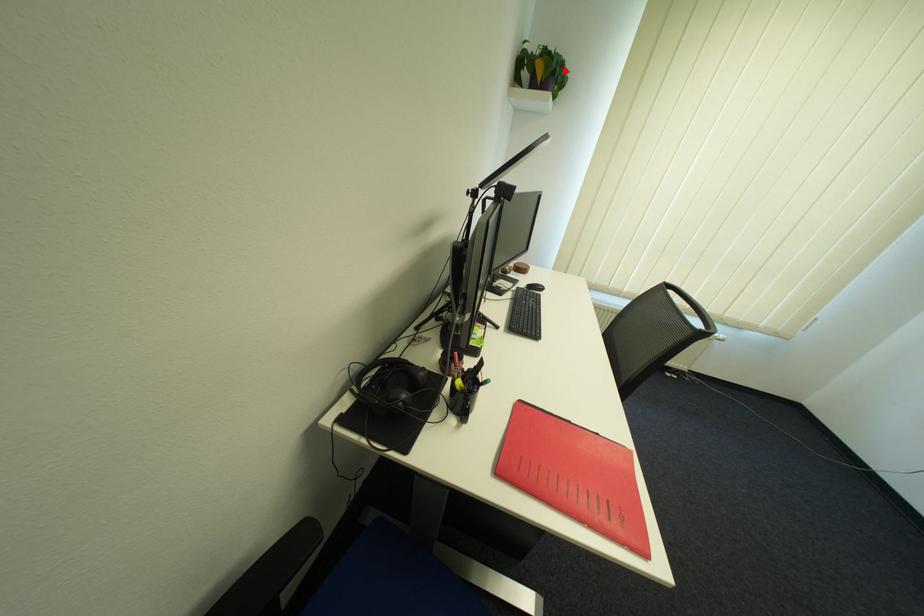
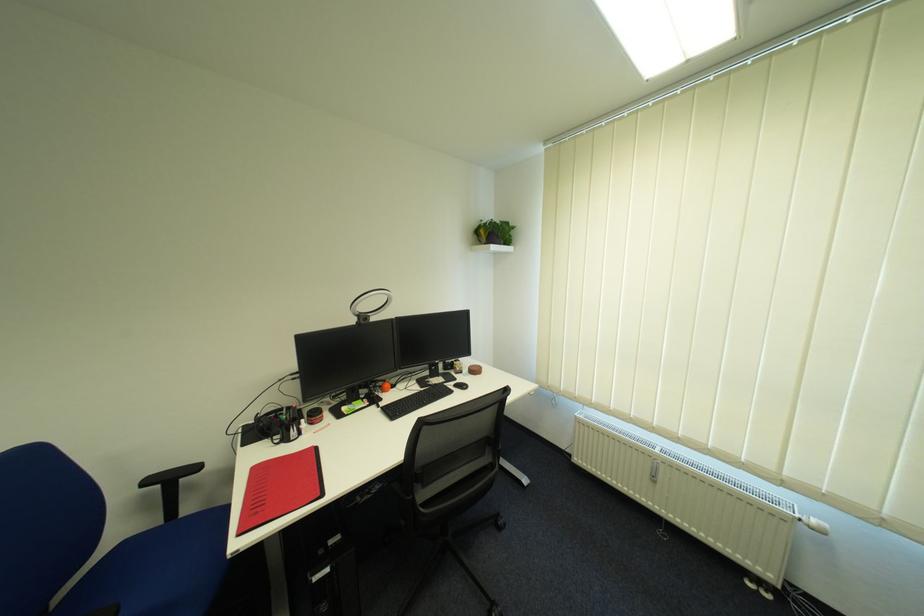
Question: I am providing you with two images of the same scene from different viewpoints. A red point is marked on the first image. Can you still see the location of the red point in image 2?

Choices:
 (A) Yes
 (B) No

Answer: (A)